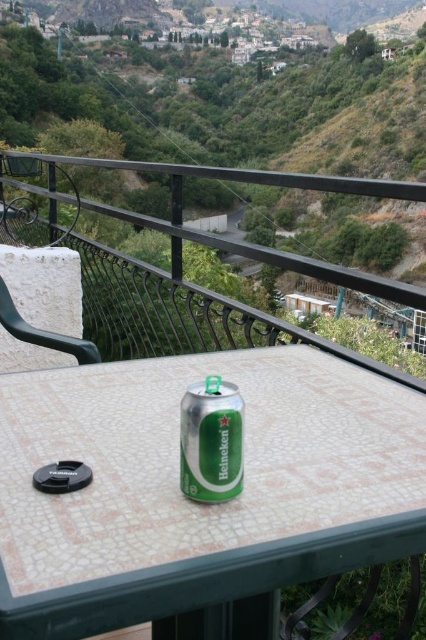
Question: Is black wrought iron railing at upper center smaller than green metallic can at center?

Choices:
 (A) no
 (B) yes

Answer: (A)

Question: Can you confirm if metallic green can at center is positioned to the left of black wrought iron railing at upper center?

Choices:
 (A) yes
 (B) no

Answer: (A)

Question: Which point is farther from the camera taking this photo?

Choices:
 (A) (x=385, y=449)
 (B) (x=5, y=307)
 (C) (x=189, y=492)

Answer: (B)

Question: Does metallic green can at center have a lesser width compared to green plastic chair at upper left?

Choices:
 (A) yes
 (B) no

Answer: (B)

Question: Which object is positioned closest to the green metallic can at center?

Choices:
 (A) green plastic chair at upper left
 (B) metallic green can at center

Answer: (B)

Question: Which object is closer to the camera taking this photo?

Choices:
 (A) green plastic chair at upper left
 (B) green metallic can at center

Answer: (B)